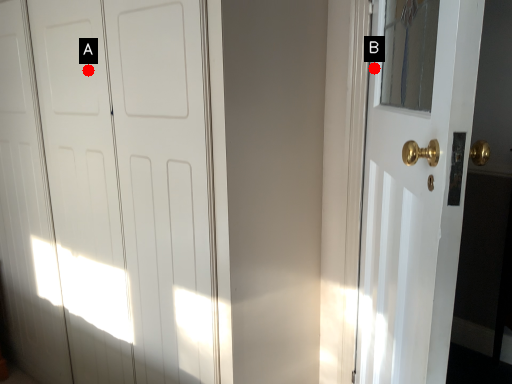
Question: Two points are circled on the image, labeled by A and B beside each circle. Which point is farther from the camera taking this photo?

Choices:
 (A) A is further
 (B) B is further

Answer: (A)